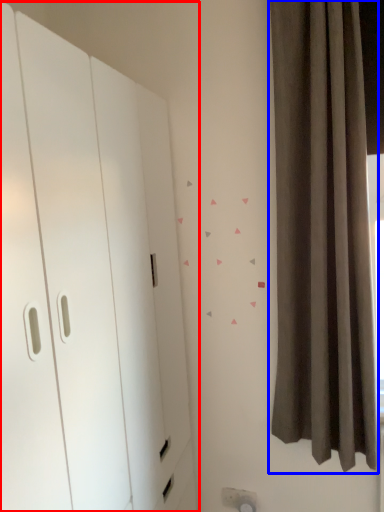
Question: Which object appears closest to the camera in this image, dresser (highlighted by a red box) or curtain (highlighted by a blue box)?

Choices:
 (A) dresser
 (B) curtain

Answer: (A)